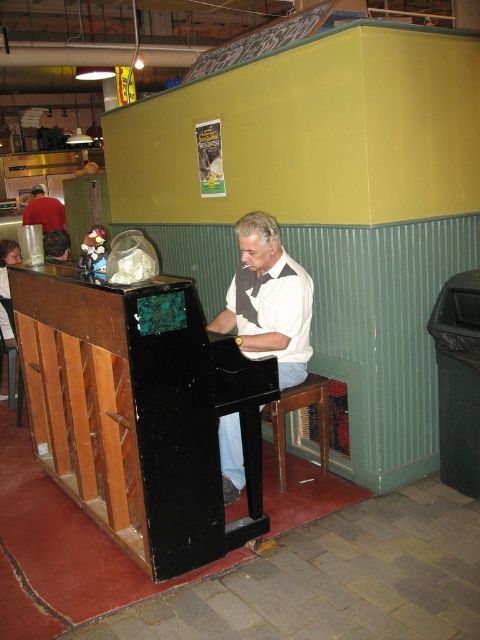
Between matte black piano at center and red shirt at left, which one has less height?

matte black piano at center is shorter.

Which is in front, point (274, 269) or point (40, 204)?

Point (274, 269) is in front.

Describe the element at coordinates (268, 300) in the screenshot. I see `matte black piano at center` at that location.

At what (x,y) coordinates should I click in order to perform the action: click on matte black piano at center. Please return your answer as a coordinate pair (x, y). Looking at the image, I should click on (268, 300).

Who is taller, matte black piano at center or wooden at center?

Standing taller between the two is matte black piano at center.

Is matte black piano at center further to the viewer compared to wooden at center?

No, it is in front of wooden at center.

The width and height of the screenshot is (480, 640). I want to click on matte black piano at center, so click(268, 300).

The height and width of the screenshot is (640, 480). I want to click on matte black piano at center, so click(x=268, y=300).

Is wooden at center wider than red shirt at left?

No.

Between wooden at center and red shirt at left, which one appears on the left side from the viewer's perspective?

red shirt at left is more to the left.

Measure the distance between point (x=325, y=384) and camera.

10.78 feet

Where is `wooden at center`? The image size is (480, 640). wooden at center is located at coordinates 298,408.